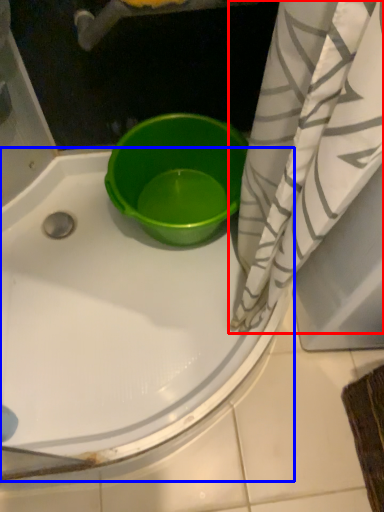
Question: Among these objects, which one is farthest to the camera, curtain (highlighted by a red box) or bathtub (highlighted by a blue box)?

Choices:
 (A) curtain
 (B) bathtub

Answer: (A)